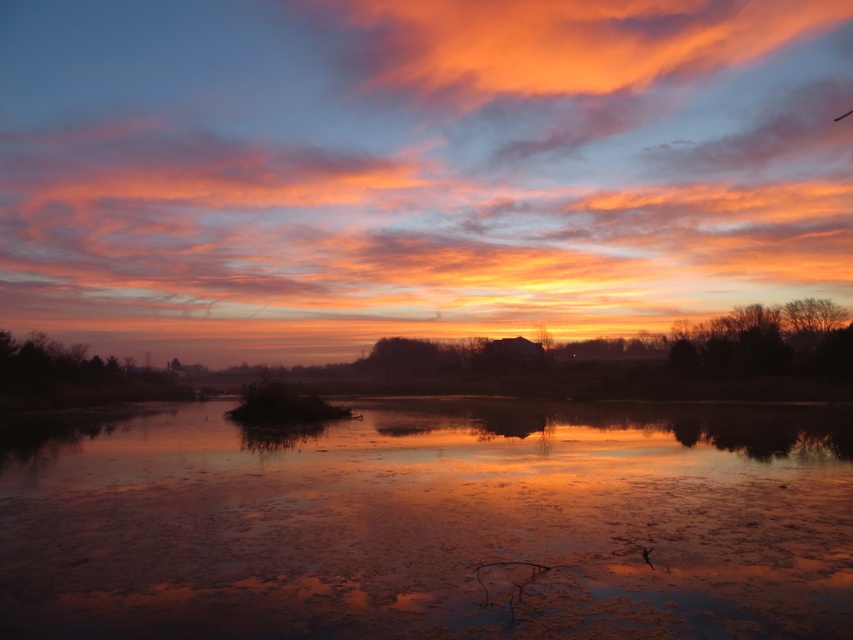
Question: Among these objects, which one is farthest from the camera?

Choices:
 (A) matte orange cloud at upper center
 (B) smooth reflective water at center

Answer: (A)

Question: Is matte orange cloud at upper center above smooth reflective water at center?

Choices:
 (A) yes
 (B) no

Answer: (A)

Question: Does matte orange cloud at upper center appear on the right side of smooth reflective water at center?

Choices:
 (A) no
 (B) yes

Answer: (B)

Question: Which object is farther from the camera taking this photo?

Choices:
 (A) smooth reflective water at center
 (B) matte orange cloud at upper center

Answer: (B)

Question: Observing the image, what is the correct spatial positioning of matte orange cloud at upper center in reference to smooth reflective water at center?

Choices:
 (A) below
 (B) above

Answer: (B)